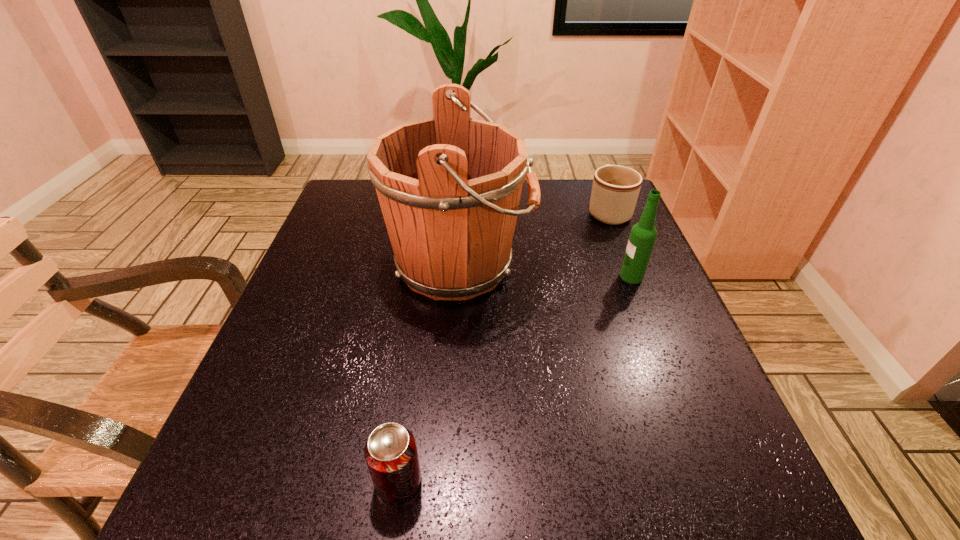
Locate an element on the screen. The height and width of the screenshot is (540, 960). mug present at the far edge is located at coordinates (615, 189).

You are a GUI agent. You are given a task and a screenshot of the screen. Output one action in this format:
    pyautogui.click(x=<x>, y=<y>)
    Task: Click on the object present at the near edge
    The image size is (960, 540).
    Given the screenshot: What is the action you would take?
    pyautogui.click(x=390, y=452)

I want to click on beer bottle present at the right edge, so click(x=643, y=234).

What are the coordinates of `mug at the right edge` in the screenshot? It's located at coord(615,189).

Where is `object present at the far right corner`? The height and width of the screenshot is (540, 960). object present at the far right corner is located at coordinates (615, 189).

Where is `free space at the far edge of the desktop`? The height and width of the screenshot is (540, 960). free space at the far edge of the desktop is located at coordinates (565, 200).

Where is `free space at the near edge`? Image resolution: width=960 pixels, height=540 pixels. free space at the near edge is located at coordinates (567, 474).

Where is `free location at the left edge of the desktop`? The width and height of the screenshot is (960, 540). free location at the left edge of the desktop is located at coordinates (275, 372).

This screenshot has height=540, width=960. What are the coordinates of `free space at the right edge of the desktop` in the screenshot? It's located at (668, 302).

Locate an element on the screen. free region at the far left corner is located at coordinates (359, 225).